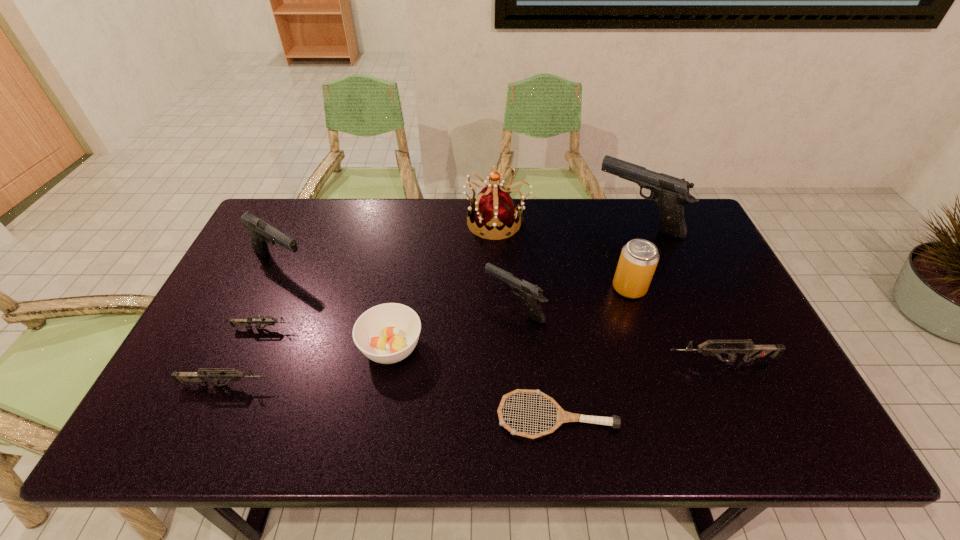
Find the location of a particular element. vacant space that's between the biggest grey gun and the second shortest gun is located at coordinates (473, 373).

The height and width of the screenshot is (540, 960). Identify the location of empty location between the red tiara and the pop (soda). coord(563,255).

Identify the location of vacant region between the shortest gun and the fifth farthest gun. (492, 345).

At what (x,y) coordinates should I click in order to perform the action: click on the sixth closest object to the soup bowl. Please return your answer as a coordinate pair (x, y). Looking at the image, I should click on (494, 209).

Identify which object is the eighth closest to the soup bowl. Please provide its 2D coordinates. Your answer should be formatted as a tuple, i.e. [(x, y)], where the tuple contains the x and y coordinates of a point satisfying the conditions above.

[(752, 351)]

Identify which gun is the second nearest to the fourth nearest gun. Please provide its 2D coordinates. Your answer should be formatted as a tuple, i.e. [(x, y)], where the tuple contains the x and y coordinates of a point satisfying the conditions above.

[(670, 193)]

Where is `gun that stands as the sixth closest to the pop (soda)`? gun that stands as the sixth closest to the pop (soda) is located at coordinates (234, 375).

I want to click on black gun that stands as the third closest to the third shortest gun, so click(261, 233).

I want to click on the second closest black gun relative to the eighth tallest object, so click(x=532, y=295).

Locate which grey gun is the third closest to the tiara. Please provide its 2D coordinates. Your answer should be formatted as a tuple, i.e. [(x, y)], where the tuple contains the x and y coordinates of a point satisfying the conditions above.

[(234, 375)]